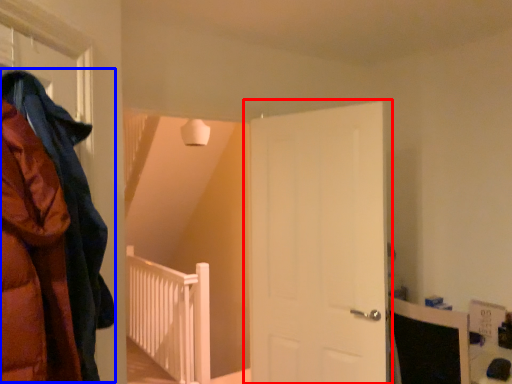
Question: Among these objects, which one is nearest to the camera, door (highlighted by a red box) or cloak (highlighted by a blue box)?

Choices:
 (A) door
 (B) cloak

Answer: (B)